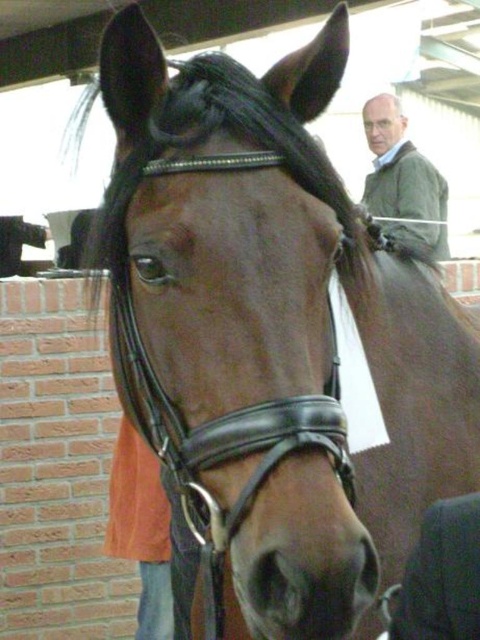
Where is `green matte jacket at upper right`? The width and height of the screenshot is (480, 640). green matte jacket at upper right is located at coordinates (403, 180).

Which is above, green matte jacket at upper right or white hair at upper center?

white hair at upper center is higher up.

Which is behind, point (421, 189) or point (384, 112)?

The point (384, 112) is behind.

Where is `green matte jacket at upper right`? green matte jacket at upper right is located at coordinates (403, 180).